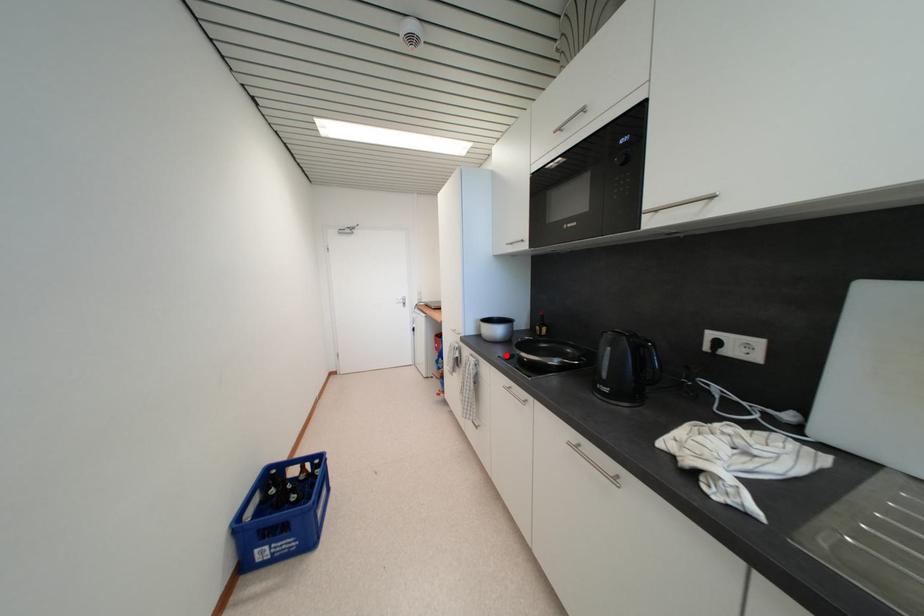
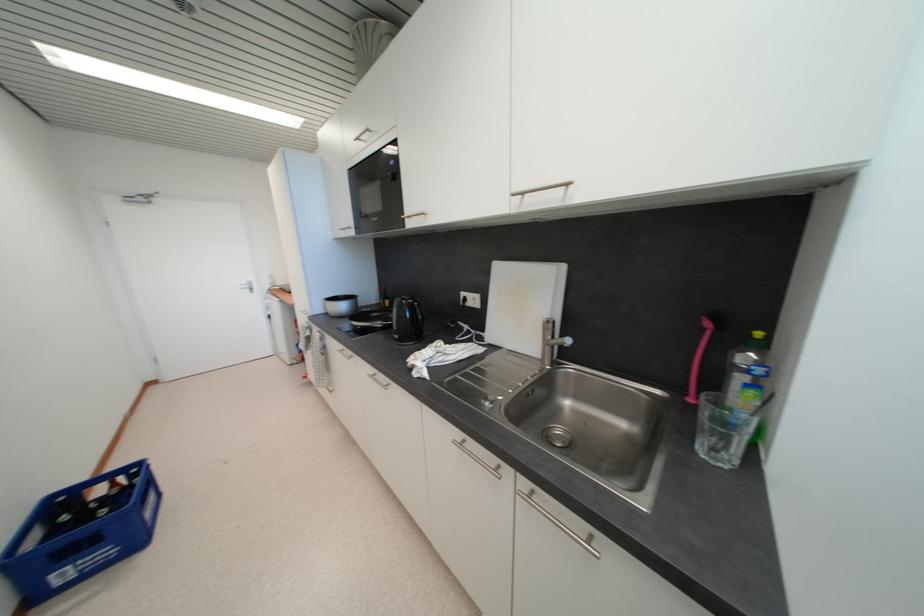
In the second image, find the point that corresponds to the highlighted location in the first image.

(351, 328)